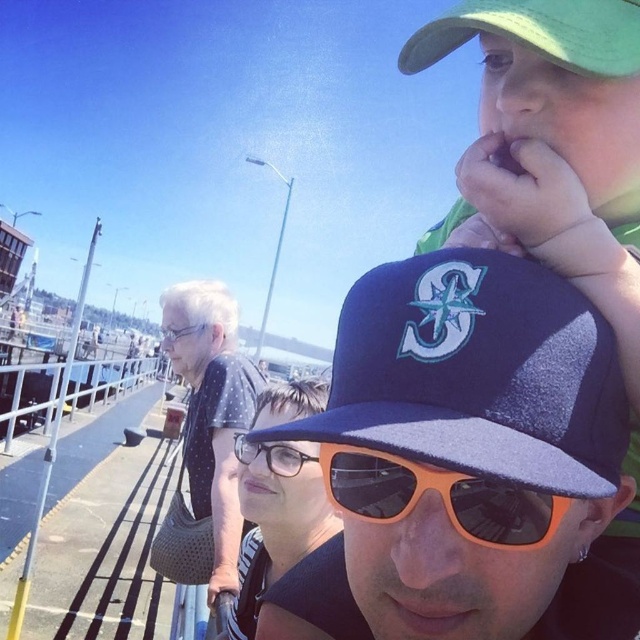
Who is taller, polka dot fabric shirt at center or green fabric baseball cap at upper right?

With more height is polka dot fabric shirt at center.

Where is `polka dot fabric shirt at center`? The width and height of the screenshot is (640, 640). polka dot fabric shirt at center is located at coordinates (211, 412).

Is navy blue mesh baseball cap at upper center shorter than green fabric baseball cap at upper right?

In fact, navy blue mesh baseball cap at upper center may be taller than green fabric baseball cap at upper right.

Between point (417, 554) and point (474, 13), which one is positioned in front?

Point (417, 554)

The height and width of the screenshot is (640, 640). Describe the element at coordinates (468, 452) in the screenshot. I see `navy blue mesh baseball cap at upper center` at that location.

Where is `navy blue mesh baseball cap at upper center`? This screenshot has width=640, height=640. navy blue mesh baseball cap at upper center is located at coordinates (468, 452).

Does point (193, 348) lie in front of point (236, 442)?

No, (193, 348) is further to viewer.

Does polka dot fabric shirt at center have a lesser width compared to clear plastic glasses at center?

Incorrect, polka dot fabric shirt at center's width is not less than clear plastic glasses at center's.

Image resolution: width=640 pixels, height=640 pixels. I want to click on polka dot fabric shirt at center, so click(x=211, y=412).